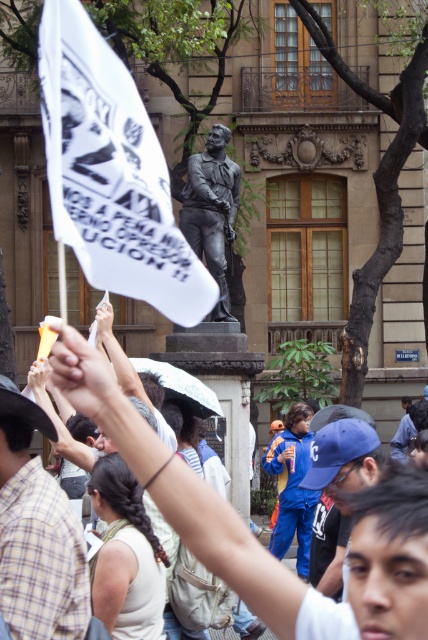
Who is taller, plaid shirt at center or bronze statue at center?

bronze statue at center

Is plaid shirt at center taller than bronze statue at center?

No, plaid shirt at center is not taller than bronze statue at center.

Does point (14, 387) lie behind point (210, 173)?

No, (14, 387) is in front of (210, 173).

This screenshot has width=428, height=640. Find the location of `plaid shirt at center`. plaid shirt at center is located at coordinates (38, 536).

Which is in front, point (59, 76) or point (214, 145)?

Positioned in front is point (59, 76).

Is point (169, 301) positioned after point (208, 172)?

That is False.

Is point (121, 113) closer to camera compared to point (222, 227)?

Yes, it is.

What are the coordinates of `white paper flag at upper left` in the screenshot? It's located at (112, 172).

Can you confirm if white paper flag at upper left is shorter than blue fabric cap at center?

Incorrect, white paper flag at upper left's height does not fall short of blue fabric cap at center's.

Which is more to the right, white paper flag at upper left or blue fabric cap at center?

From the viewer's perspective, blue fabric cap at center appears more on the right side.

Where is `white paper flag at upper left`? This screenshot has width=428, height=640. white paper flag at upper left is located at coordinates (112, 172).